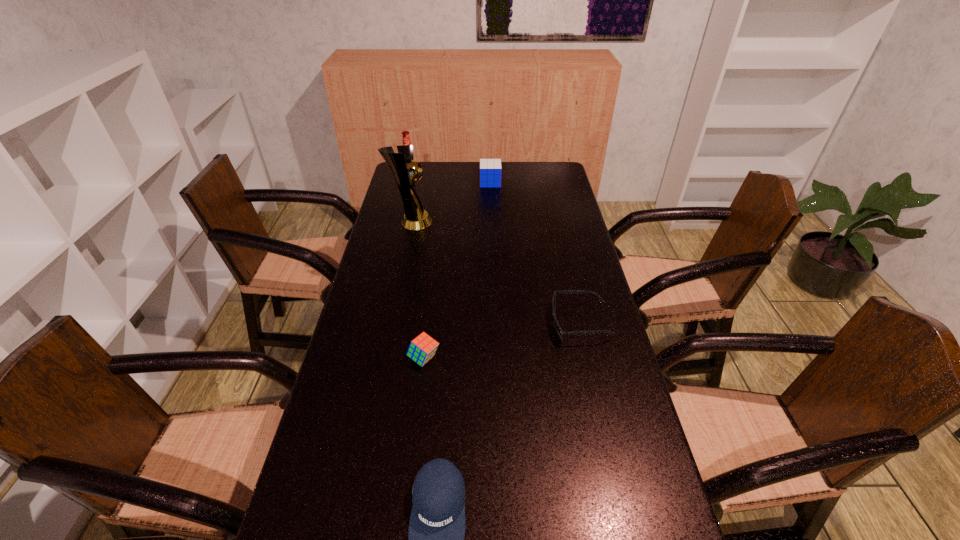
Image resolution: width=960 pixels, height=540 pixels. Identify the location of vacant space located on the back of the fifth shortest object. [414, 169].

Find the location of a particular element. This screenshot has width=960, height=540. vacant area situated on the front of the farther cube is located at coordinates (492, 208).

Where is `vacant space located on the left of the nearer cube`? Image resolution: width=960 pixels, height=540 pixels. vacant space located on the left of the nearer cube is located at coordinates (385, 358).

Find the location of a particular element. The width and height of the screenshot is (960, 540). vacant space positioned 0.300m on the front-facing side of the rightmost object is located at coordinates (447, 323).

Locate an element on the screen. Image resolution: width=960 pixels, height=540 pixels. free space located on the front-facing side of the rightmost object is located at coordinates (465, 323).

What are the coordinates of `vacant space located 0.370m on the front-facing side of the rightmost object` in the screenshot? It's located at (422, 323).

I want to click on root beer at the far edge, so click(x=406, y=140).

Where is `cube that is positioned at the far edge`? This screenshot has height=540, width=960. cube that is positioned at the far edge is located at coordinates (490, 169).

Where is `award present at the left edge`? award present at the left edge is located at coordinates (402, 165).

Locate an element on the screen. root beer present at the left edge is located at coordinates (406, 140).